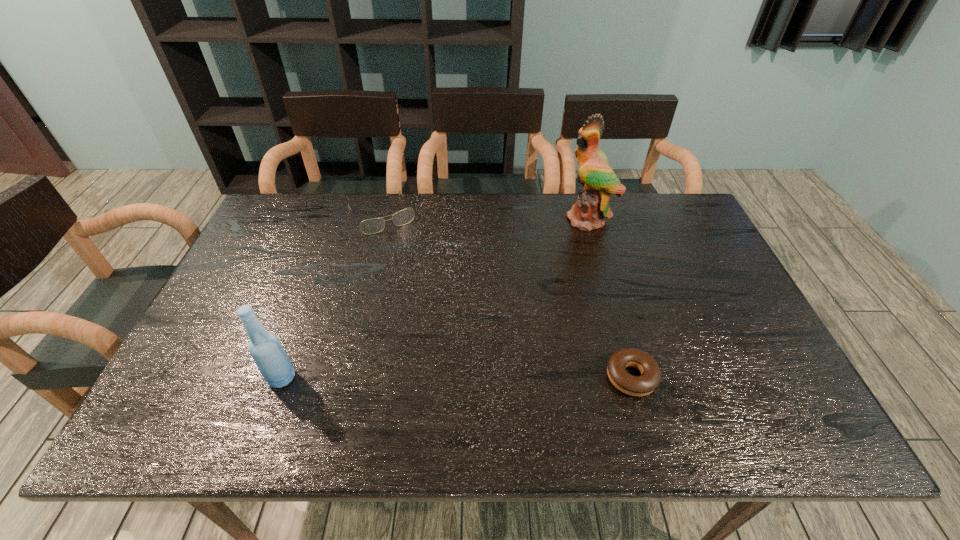
You are a GUI agent. You are given a task and a screenshot of the screen. Output one action in this format:
    pyautogui.click(x=<x>, y=<y>)
    Task: Click on the vacant space on the desktop that is between the bottle and the shortest object and is positioned on the front-facing side of the tallest object
    This screenshot has height=540, width=960.
    Given the screenshot: What is the action you would take?
    pyautogui.click(x=458, y=377)

Locate an element on the screen. The image size is (960, 540). free space on the desktop that is between the bottle and the doughnut and is positioned on the front-facing side of the second shortest object is located at coordinates (478, 377).